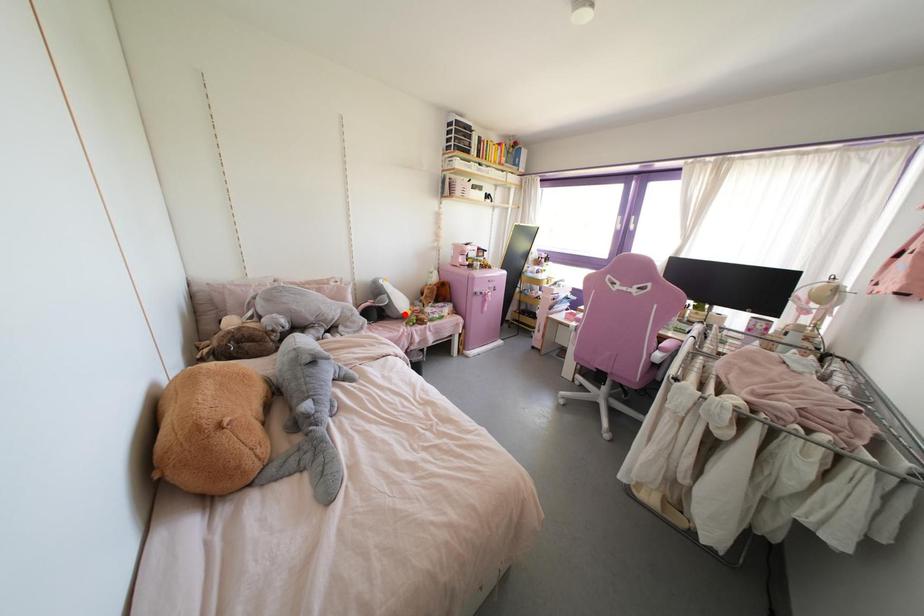
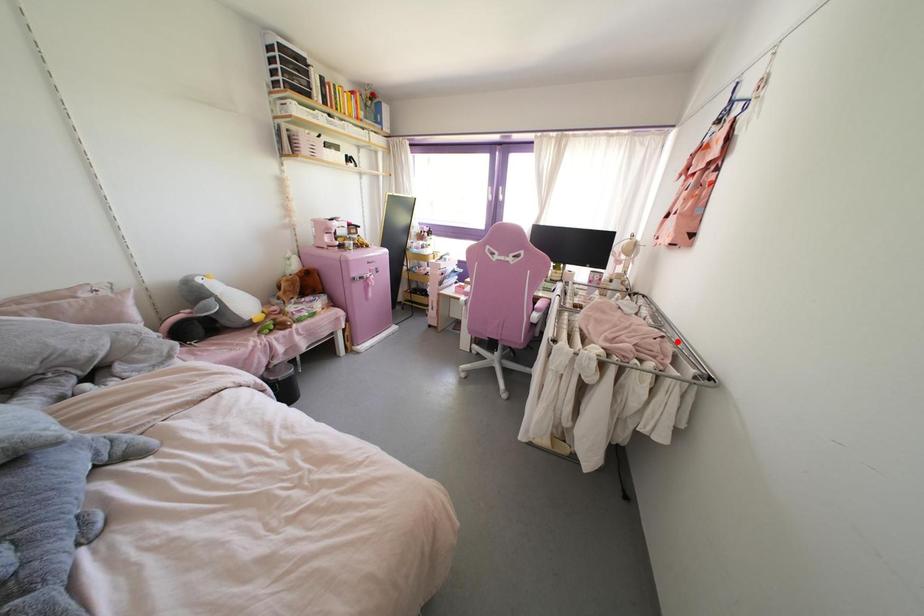
I am providing you with two images of the same scene from different viewpoints. A red point is marked on the first image and another point is marked on the second image. Are the points marked in image1 and image2 representing the same 3D position?

No